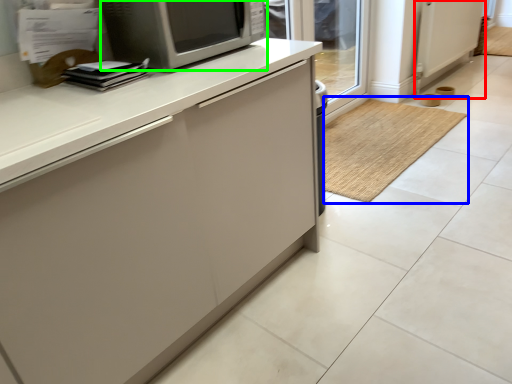
Question: Estimate the real-world distances between objects in this image. Which object is farther from screen door (highlighted by a red box), doormat (highlighted by a blue box) or microwave oven (highlighted by a green box)?

Choices:
 (A) doormat
 (B) microwave oven

Answer: (B)